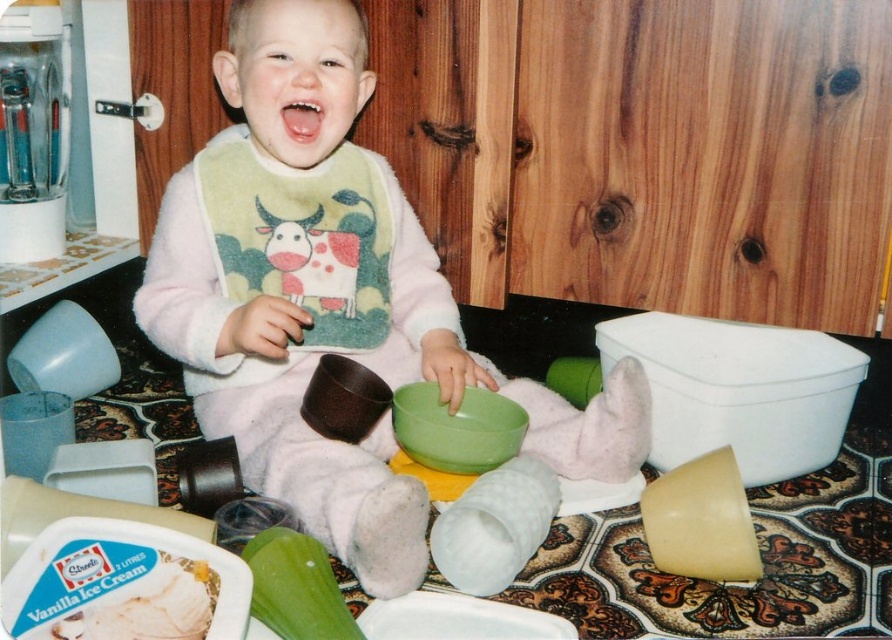
You are a photographer trying to capture a clear shot of the pink fleece bib at center and the pink matte mouth at center. Which object should you focus on first to ensure both are in focus?

The photographer should focus on the pink fleece bib at center first since it is closer to the viewer than the pink matte mouth at center, ensuring both will be in focus when starting with the nearer object.

The child in the scene has a pink fleece bib at center and a pink matte mouth at center. Which object is positioned lower on the child?

The pink fleece bib at center is positioned lower than the pink matte mouth at center.

The pink fleece bib at center is located at coordinates 0.469, 0.371. Can you describe its position relative to the other objects in the scene?

The pink fleece bib at center is positioned at coordinates (329, 300), which is centrally located in the scene.